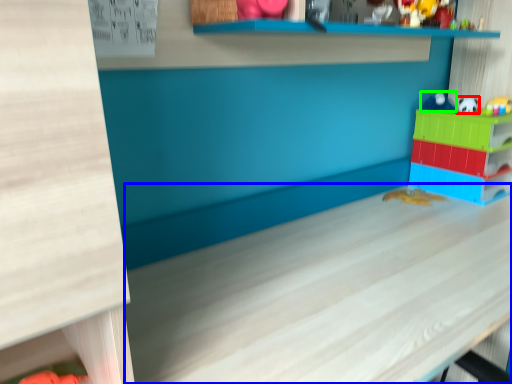
Question: Considering the real-world distances, which object is farthest from toy (highlighted by a red box)? table (highlighted by a blue box) or toy (highlighted by a green box)?

Choices:
 (A) table
 (B) toy

Answer: (A)